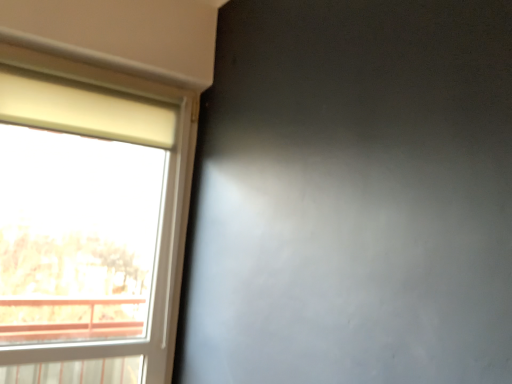
Describe the element at coordinates (89, 221) in the screenshot. I see `transparent glass window at left` at that location.

The width and height of the screenshot is (512, 384). I want to click on transparent glass window at left, so click(89, 221).

Where is `transparent glass window at left`? transparent glass window at left is located at coordinates (89, 221).